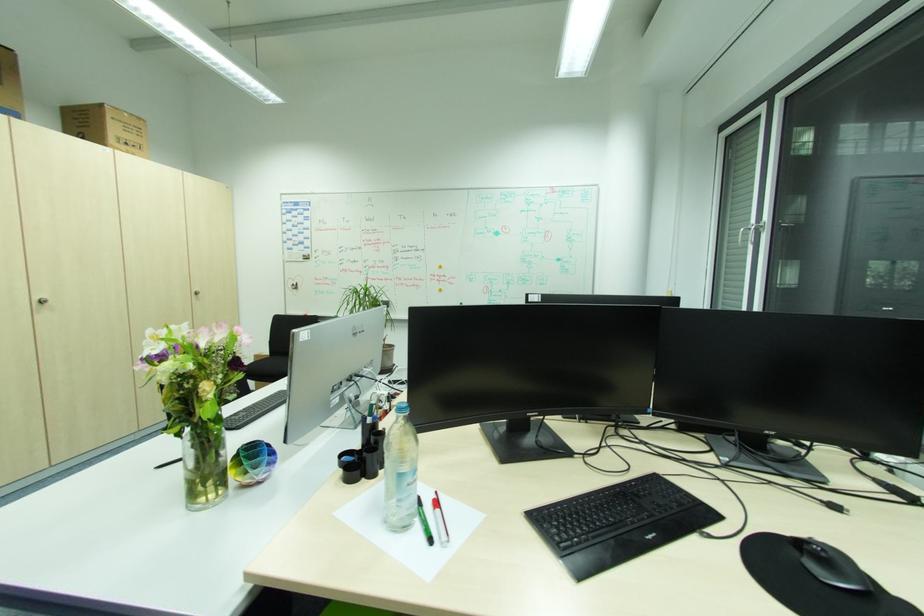
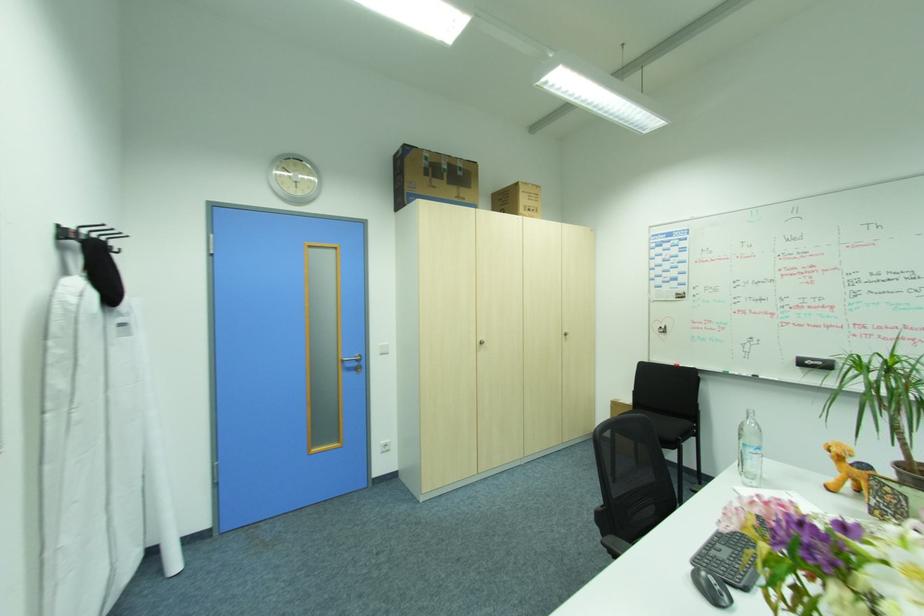
Question: The camera is either moving clockwise (left) or counter-clockwise (right) around the object. The first image is from the beginning of the video and the second image is from the end. Is the camera moving left or right when shooting the video?

Choices:
 (A) Left
 (B) Right

Answer: (B)